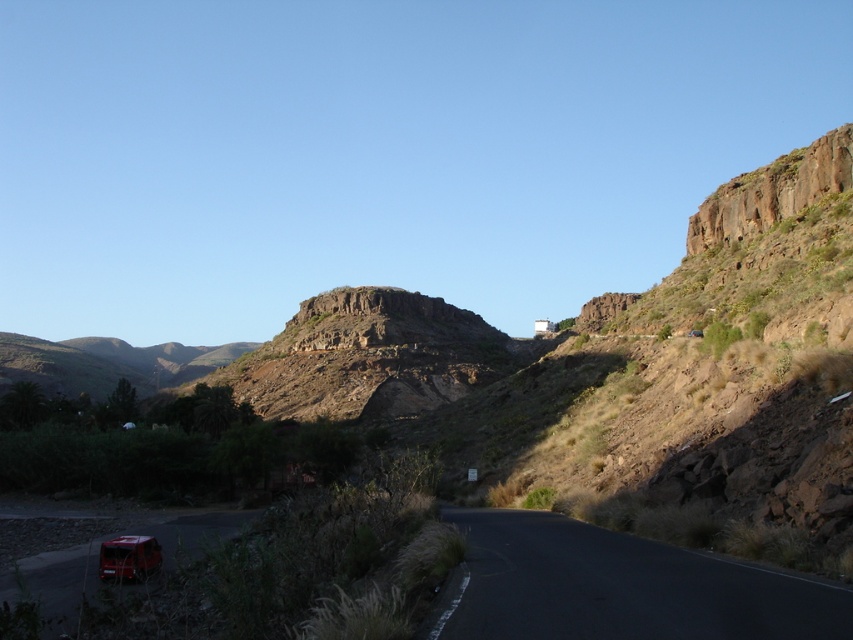
Question: Does black asphalt road at lower right appear under metallic red car at lower left?

Choices:
 (A) no
 (B) yes

Answer: (A)

Question: Which of the following is the farthest from the observer?

Choices:
 (A) black asphalt road at lower right
 (B) metallic red car at lower left

Answer: (B)

Question: Which object appears closest to the camera in this image?

Choices:
 (A) black asphalt road at lower right
 (B) metallic red car at lower left

Answer: (A)

Question: Is black asphalt road at lower right bigger than metallic red car at lower left?

Choices:
 (A) no
 (B) yes

Answer: (B)

Question: Among these points, which one is farthest from the camera?

Choices:
 (A) (136, 556)
 (B) (454, 608)

Answer: (A)

Question: Can you confirm if black asphalt road at lower right is positioned to the left of metallic red car at lower left?

Choices:
 (A) no
 (B) yes

Answer: (A)